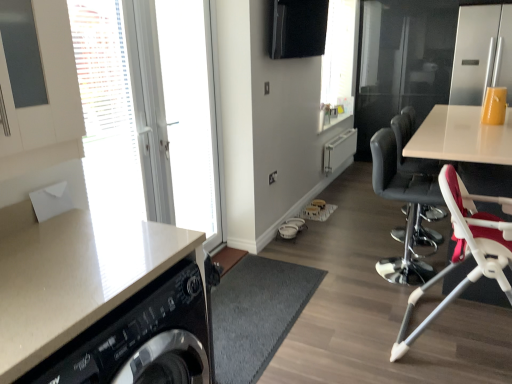
The width and height of the screenshot is (512, 384). I want to click on vacant space that's between red fabric high chair at right, positioned as the second chair in back-to-front order, and white plastic high chair at right, so click(x=396, y=316).